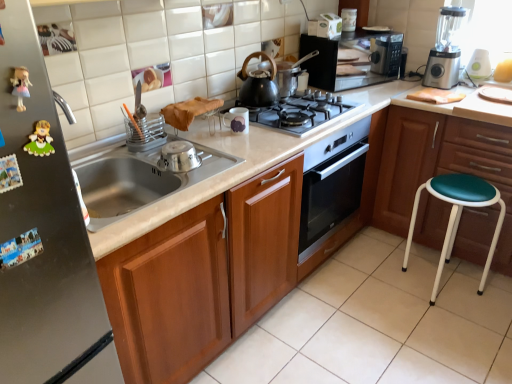
I want to click on vacant space to the left of teal vinyl stool at lower right, so click(370, 284).